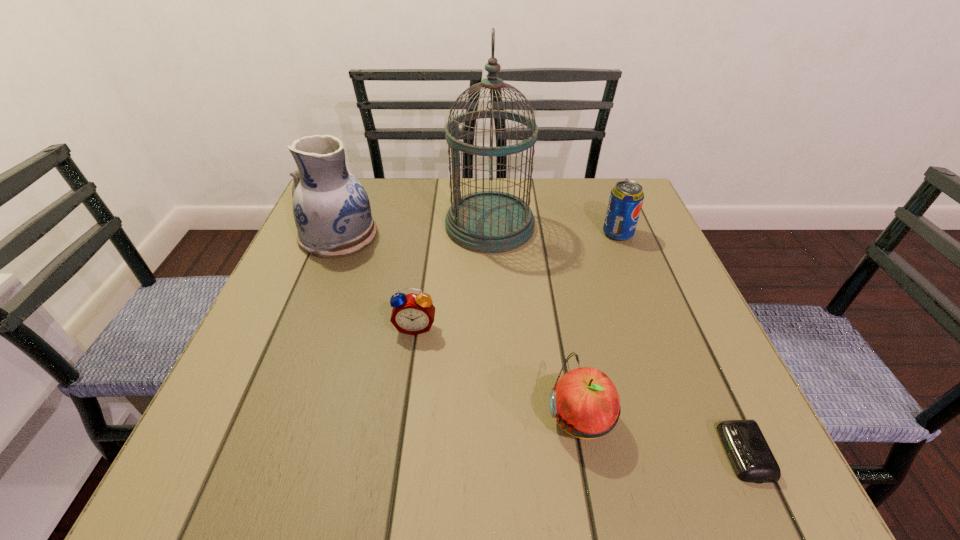
I want to click on vacant space located on the front-facing side of the birdcage, so click(339, 226).

Locate an element on the screen. free location located on the front-facing side of the birdcage is located at coordinates (360, 226).

Identify the location of vacant area situated on the right of the pottery. The height and width of the screenshot is (540, 960). (444, 235).

Image resolution: width=960 pixels, height=540 pixels. What are the coordinates of `vacant space located 0.270m on the front of the soda` in the screenshot? It's located at (656, 331).

Where is `vacant space positioned on the back of the apple`? The height and width of the screenshot is (540, 960). vacant space positioned on the back of the apple is located at coordinates (567, 349).

Where is `vacant space situated 0.140m on the front-facing side of the taller alarm clock`? vacant space situated 0.140m on the front-facing side of the taller alarm clock is located at coordinates (404, 402).

The image size is (960, 540). Find the location of `vacant position located on the display of the shorter alarm clock`. vacant position located on the display of the shorter alarm clock is located at coordinates (536, 453).

Image resolution: width=960 pixels, height=540 pixels. In order to click on free point located on the display of the shorter alarm clock in this screenshot , I will do `click(664, 453)`.

Locate an element on the screen. Image resolution: width=960 pixels, height=540 pixels. vacant space situated 0.360m on the display of the shorter alarm clock is located at coordinates (482, 453).

You are a GUI agent. You are given a task and a screenshot of the screen. Output one action in this format:
    pyautogui.click(x=<x>, y=<y>)
    Task: Click on the birdcage that is at the far edge
    The image size is (960, 540).
    Given the screenshot: What is the action you would take?
    pyautogui.click(x=489, y=221)